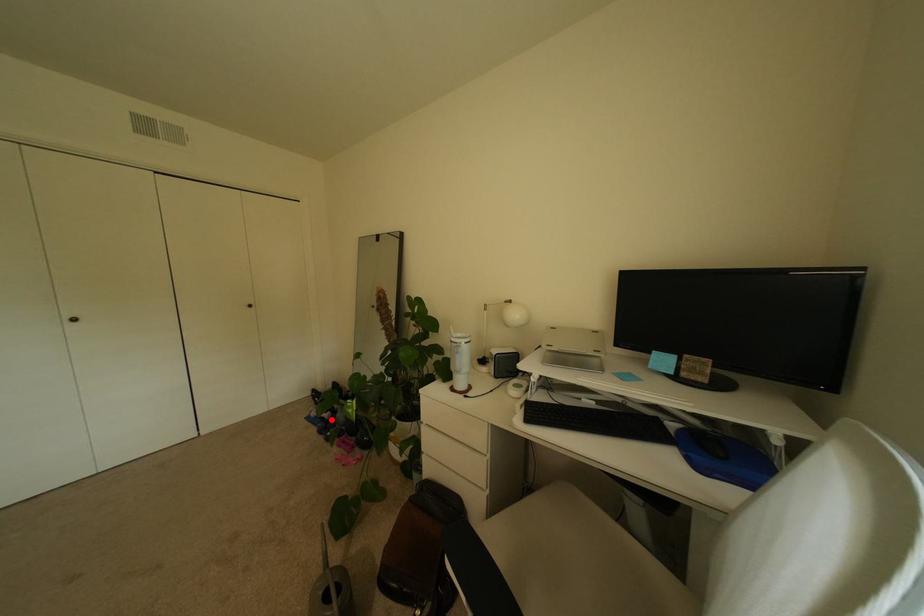
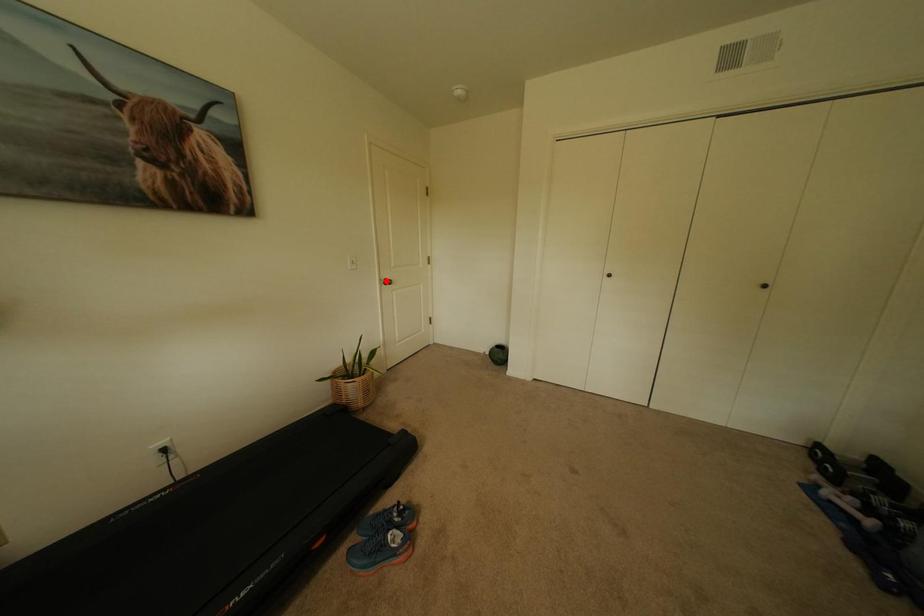
I am providing you with two images of the same scene from different viewpoints. A red point is marked on the first image and another point is marked on the second image. Is the red point in image1 aligned with the point shown in image2?

No